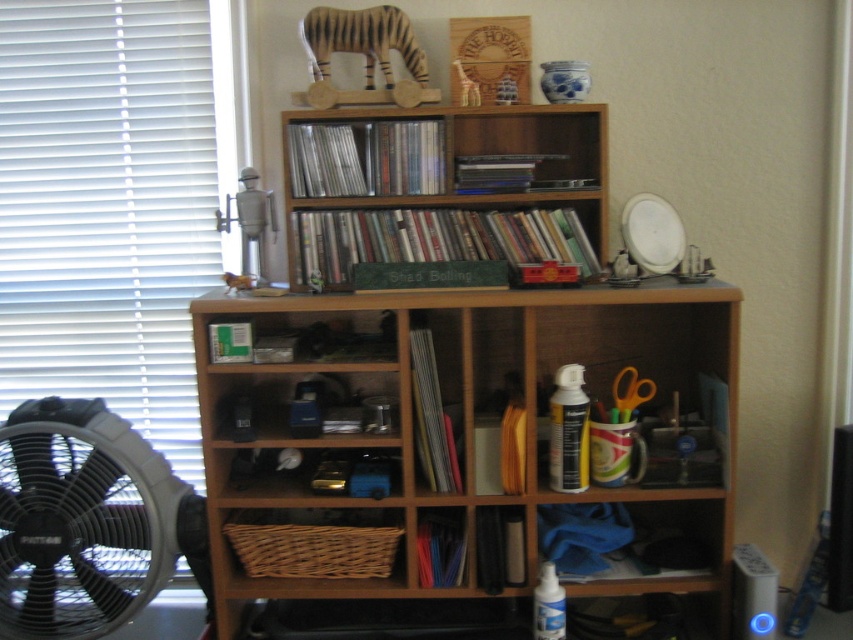
Question: Is wooden bookcase at center wider than metallic robot at upper center?

Choices:
 (A) no
 (B) yes

Answer: (B)

Question: Does wooden bookshelf at center come behind black plastic fan at left?

Choices:
 (A) yes
 (B) no

Answer: (A)

Question: Which object is farther from the camera taking this photo?

Choices:
 (A) black plastic fan at left
 (B) orange plastic scissors at center
 (C) wooden bookcase at center
 (D) wooden bookshelf at center

Answer: (D)

Question: Which object is positioned farthest from the metallic robot at upper center?

Choices:
 (A) white blinds at left
 (B) wooden bookshelf at center
 (C) orange plastic scissors at center

Answer: (C)

Question: Does wooden bookcase at center lie behind white blinds at left?

Choices:
 (A) no
 (B) yes

Answer: (A)

Question: Which of the following is the closest to the observer?

Choices:
 (A) orange plastic scissors at center
 (B) white blinds at left
 (C) wooden bookcase at center

Answer: (C)